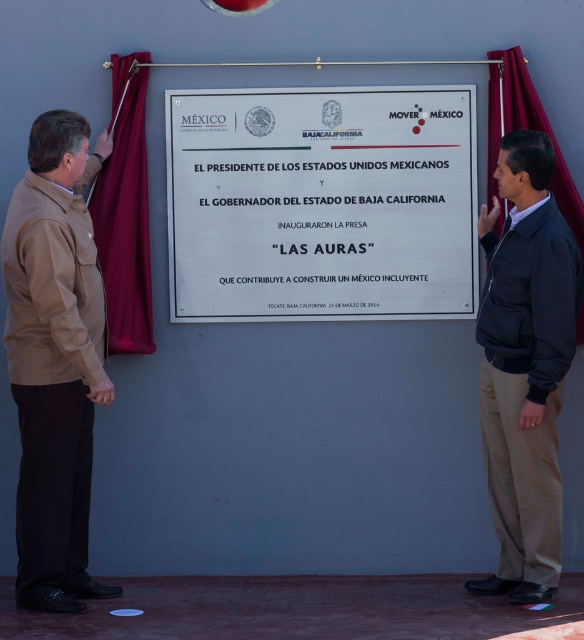
Question: Which of the following is the closest to the observer?

Choices:
 (A) (544, 484)
 (B) (12, 364)

Answer: (A)

Question: Is tan fabric jacket at left above dark blue jacket at right?

Choices:
 (A) no
 (B) yes

Answer: (B)

Question: Which point appears closest to the camera in this image?

Choices:
 (A) (439, 312)
 (B) (37, 262)

Answer: (B)

Question: Does tan fabric jacket at left have a smaller size compared to dark blue jacket at right?

Choices:
 (A) yes
 (B) no

Answer: (A)

Question: Which object appears closest to the camera in this image?

Choices:
 (A) white metallic plaque at center
 (B) tan fabric jacket at left

Answer: (B)

Question: Is white metallic plaque at center smaller than dark blue jacket at right?

Choices:
 (A) yes
 (B) no

Answer: (A)